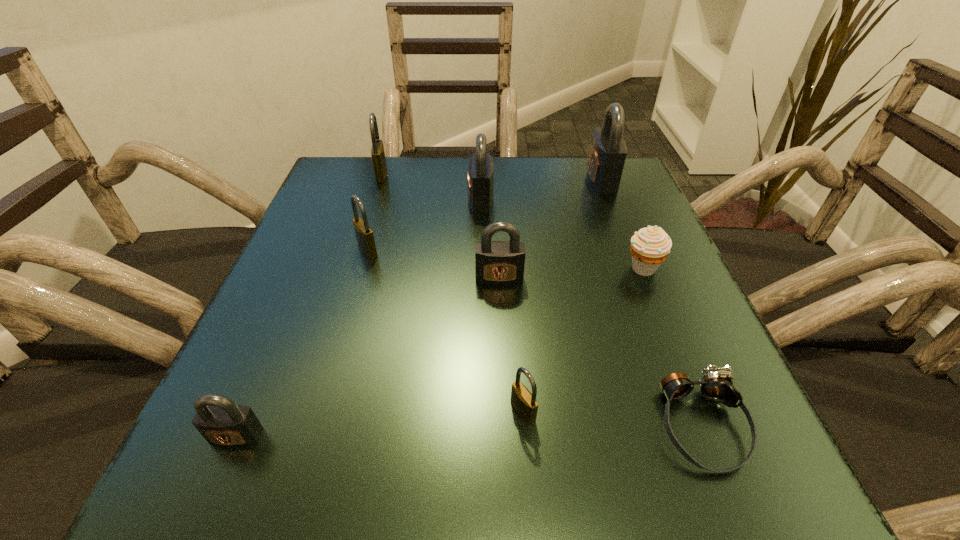
Locate an element on the screen. The height and width of the screenshot is (540, 960). the smallest brass padlock is located at coordinates (524, 403).

Where is `the leftmost gray padlock`? The height and width of the screenshot is (540, 960). the leftmost gray padlock is located at coordinates (222, 422).

Where is `the leftmost padlock`? the leftmost padlock is located at coordinates (222, 422).

Where is `goggles`? The width and height of the screenshot is (960, 540). goggles is located at coordinates (x=715, y=386).

At what (x,y) coordinates should I click in order to perform the action: click on the shortest object. Please return your answer as a coordinate pair (x, y). The height and width of the screenshot is (540, 960). Looking at the image, I should click on (715, 386).

Locate an element on the screen. free space located on the front of the rightmost padlock near the keyhole is located at coordinates (562, 180).

The image size is (960, 540). I want to click on vacant space located 0.320m on the front of the rightmost padlock near the keyhole, so click(450, 180).

This screenshot has height=540, width=960. Identify the location of vacant space situated on the front of the rightmost padlock near the keyhole. (459, 180).

Find the location of `vacant space situated on the front of the second biggest gray padlock near the keyhole`. vacant space situated on the front of the second biggest gray padlock near the keyhole is located at coordinates [x=323, y=199].

Locate an element on the screen. Image resolution: width=960 pixels, height=540 pixels. vacant space located 0.200m on the front of the second biggest gray padlock near the keyhole is located at coordinates (377, 199).